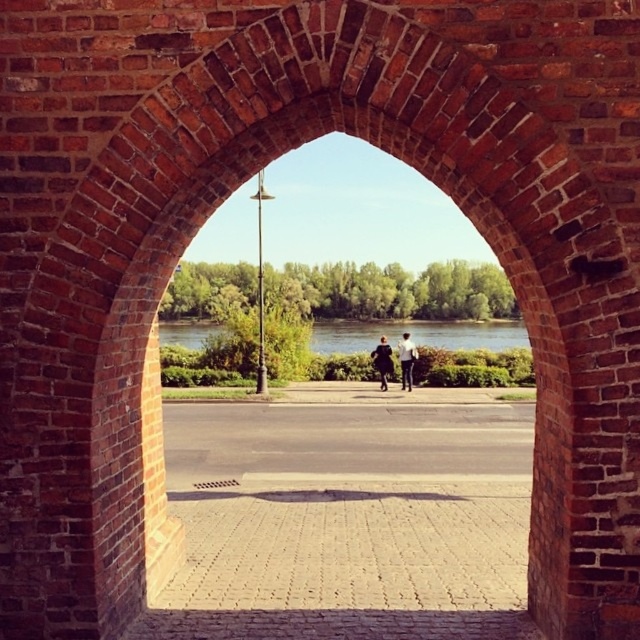
Which is in front, point (406, 362) or point (380, 339)?

Point (406, 362) is in front.

Is light blue jeans at center bigger than dark blue fabric jacket at center?

Correct, light blue jeans at center is larger in size than dark blue fabric jacket at center.

Locate an element on the screen. Image resolution: width=640 pixels, height=640 pixels. light blue jeans at center is located at coordinates (406, 360).

Which is behind, point (408, 348) or point (400, 356)?

The point (400, 356) is more distant.

Which is above, dark gray fabric coat at center or light blue jeans at center?

dark gray fabric coat at center is above.

Find the location of a particular element. dark gray fabric coat at center is located at coordinates [x=406, y=360].

Based on the photo, does dark gray fabric coat at center come behind dark blue fabric jacket at center?

That is True.

The width and height of the screenshot is (640, 640). What are the coordinates of `dark gray fabric coat at center` in the screenshot? It's located at (406, 360).